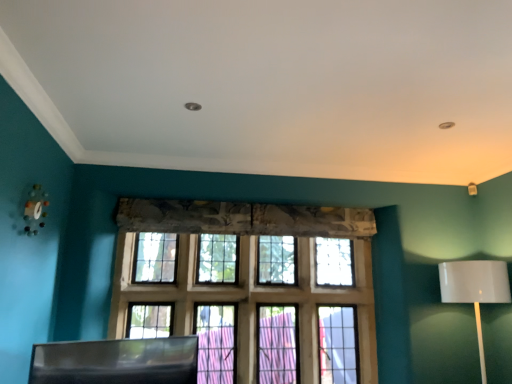
Question: Is white glossy table lamp at right smaller than black plastic swivel chair at lower left?

Choices:
 (A) yes
 (B) no

Answer: (B)

Question: From a real-world perspective, does white glossy table lamp at right stand above black plastic swivel chair at lower left?

Choices:
 (A) no
 (B) yes

Answer: (B)

Question: Can you confirm if white glossy table lamp at right is positioned to the left of black plastic swivel chair at lower left?

Choices:
 (A) no
 (B) yes

Answer: (A)

Question: Is white glossy table lamp at right touching black plastic swivel chair at lower left?

Choices:
 (A) yes
 (B) no

Answer: (B)

Question: Is white glossy table lamp at right turned away from black plastic swivel chair at lower left?

Choices:
 (A) yes
 (B) no

Answer: (B)

Question: From the image's perspective, is white glossy table lamp at right below black plastic swivel chair at lower left?

Choices:
 (A) yes
 (B) no

Answer: (B)

Question: From a real-world perspective, is wooden grid window at center below white glossy table lamp at right?

Choices:
 (A) no
 (B) yes

Answer: (A)

Question: Is wooden grid window at center looking in the opposite direction of white glossy table lamp at right?

Choices:
 (A) yes
 (B) no

Answer: (B)

Question: Is wooden grid window at center far from white glossy table lamp at right?

Choices:
 (A) yes
 (B) no

Answer: (A)

Question: Considering the relative sizes of wooden grid window at center and white glossy table lamp at right in the image provided, is wooden grid window at center smaller than white glossy table lamp at right?

Choices:
 (A) no
 (B) yes

Answer: (A)

Question: Can we say wooden grid window at center lies outside white glossy table lamp at right?

Choices:
 (A) yes
 (B) no

Answer: (A)

Question: From a real-world perspective, is wooden grid window at center on top of white glossy table lamp at right?

Choices:
 (A) no
 (B) yes

Answer: (B)

Question: Is the depth of black plastic swivel chair at lower left less than that of white glossy table lamp at right?

Choices:
 (A) no
 (B) yes

Answer: (B)